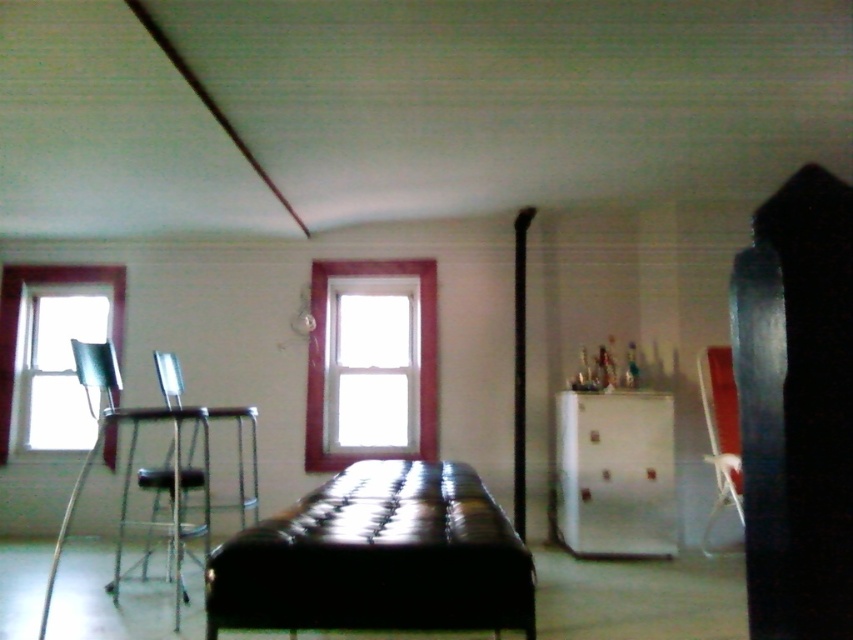
Which is below, wooden frame window at center or metallic silver chair at right?

Positioned lower is metallic silver chair at right.

From the picture: Does wooden frame window at center lie in front of metallic silver chair at right?

No, wooden frame window at center is behind metallic silver chair at right.

Locate an element on the screen. The height and width of the screenshot is (640, 853). wooden frame window at center is located at coordinates (323, 355).

This screenshot has height=640, width=853. I want to click on wooden frame window at center, so click(x=323, y=355).

Can you confirm if black leather bed at center is smaller than clear glass window at left?

No, black leather bed at center is not smaller than clear glass window at left.

Can you confirm if black leather bed at center is positioned below clear glass window at left?

Indeed, black leather bed at center is positioned under clear glass window at left.

Which is behind, point (380, 618) or point (3, 460)?

Positioned behind is point (3, 460).

Locate an element on the screen. This screenshot has height=640, width=853. black leather bed at center is located at coordinates (376, 557).

Who is taller, metallic silver chair at right or metallic silver chair at left?

metallic silver chair at right is taller.

Does metallic silver chair at right have a lesser height compared to metallic silver chair at left?

In fact, metallic silver chair at right may be taller than metallic silver chair at left.

Locate an element on the screen. metallic silver chair at right is located at coordinates (720, 435).

Where is `metallic silver chair at right`? Image resolution: width=853 pixels, height=640 pixels. metallic silver chair at right is located at coordinates (720, 435).